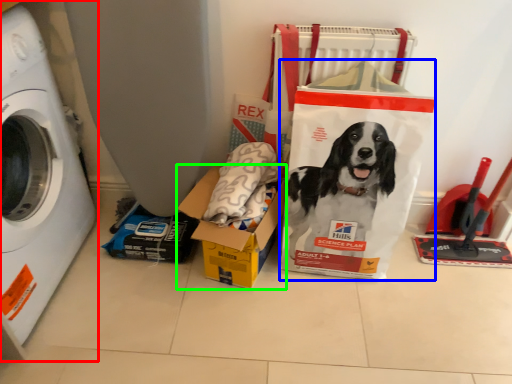
Question: Based on their relative distances, which object is farther from washing machine (highlighted by a red box)? Choose from paper bag (highlighted by a blue box) and box (highlighted by a green box).

Choices:
 (A) paper bag
 (B) box

Answer: (A)